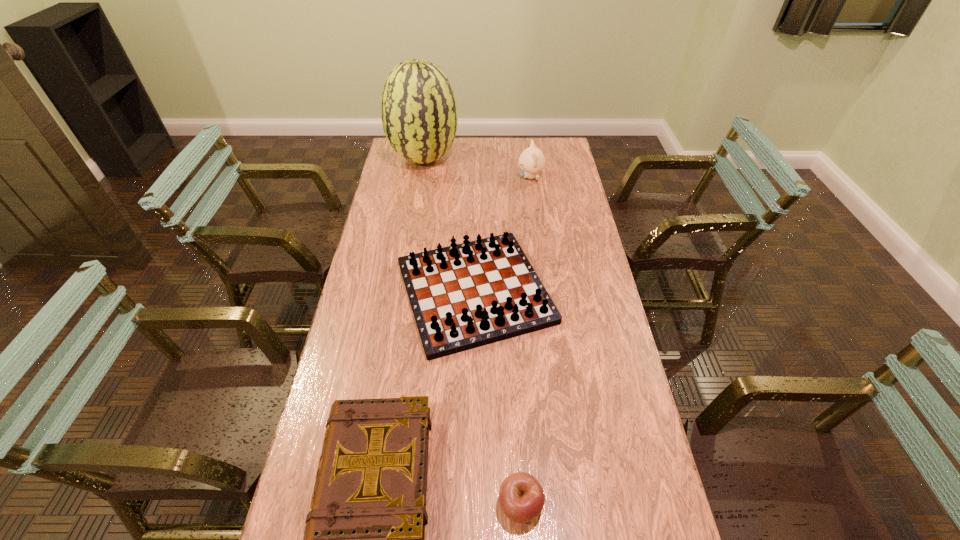
Where is `vacant space at the far right corner of the desktop`? Image resolution: width=960 pixels, height=540 pixels. vacant space at the far right corner of the desktop is located at coordinates (565, 143).

Locate an element on the screen. free spot between the third farthest object and the apple is located at coordinates (497, 399).

Locate an element on the screen. The height and width of the screenshot is (540, 960). vacant area between the third nearest object and the apple is located at coordinates (497, 399).

The width and height of the screenshot is (960, 540). In order to click on empty space that is in between the tallest object and the fourth shortest object in this screenshot , I will do `click(477, 168)`.

In order to click on the fourth closest object to the third shortest object in this screenshot , I will do `click(419, 114)`.

Identify which object is the nearest to the hardback book. Please provide its 2D coordinates. Your answer should be formatted as a tuple, i.e. [(x, y)], where the tuple contains the x and y coordinates of a point satisfying the conditions above.

[(463, 296)]

Locate an element on the screen. The width and height of the screenshot is (960, 540). vacant space that satisfies the following two spatial constraints: 1. on the face of the second tallest object; 2. on the side of the apple with the unique marking is located at coordinates (577, 505).

This screenshot has height=540, width=960. Identify the location of free region that satisfies the following two spatial constraints: 1. on the front side of the watermelon; 2. on the left side of the third nearest object. click(402, 292).